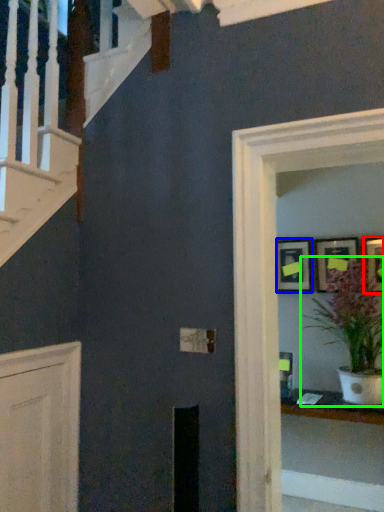
Question: Considering the real-world distances, which object is closest to picture frame (highlighted by a red box)? picture frame (highlighted by a blue box) or houseplant (highlighted by a green box).

Choices:
 (A) picture frame
 (B) houseplant

Answer: (B)